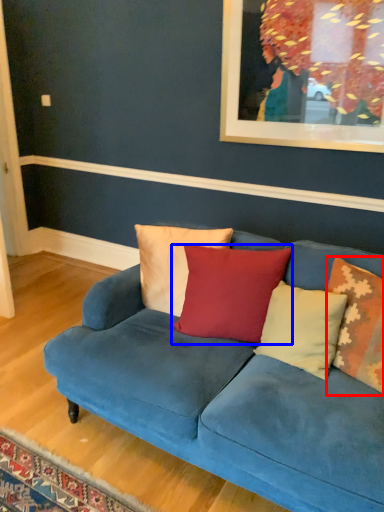
Question: Which object is further to the camera taking this photo, pillow (highlighted by a red box) or pillow (highlighted by a blue box)?

Choices:
 (A) pillow
 (B) pillow

Answer: (B)